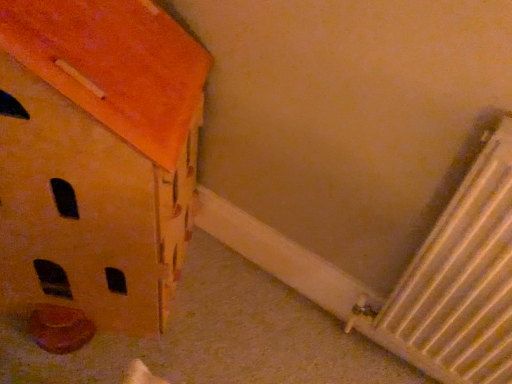
Question: Is white metallic radiator at lower right bigger or smaller than matte orange cardboard box at lower left?

Choices:
 (A) small
 (B) big

Answer: (A)

Question: Considering the positions of white metallic radiator at lower right and matte orange cardboard box at lower left in the image, is white metallic radiator at lower right wider or thinner than matte orange cardboard box at lower left?

Choices:
 (A) thin
 (B) wide

Answer: (A)

Question: From the image's perspective, is white metallic radiator at lower right located above or below matte orange cardboard box at lower left?

Choices:
 (A) above
 (B) below

Answer: (B)

Question: From a real-world perspective, is matte orange cardboard box at lower left above or below white metallic radiator at lower right?

Choices:
 (A) above
 (B) below

Answer: (B)

Question: From the image's perspective, relative to white metallic radiator at lower right, is matte orange cardboard box at lower left above or below?

Choices:
 (A) above
 (B) below

Answer: (A)

Question: Is matte orange cardboard box at lower left wider or thinner than white metallic radiator at lower right?

Choices:
 (A) wide
 (B) thin

Answer: (A)

Question: Choose the correct answer: Is matte orange cardboard box at lower left inside white metallic radiator at lower right or outside it?

Choices:
 (A) inside
 (B) outside

Answer: (B)